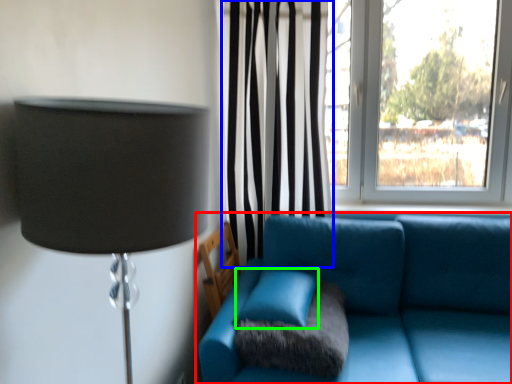
Question: Based on their relative distances, which object is farther from studio couch (highlighted by a red box)? Choose from curtain (highlighted by a blue box) and turquoise (highlighted by a green box).

Choices:
 (A) curtain
 (B) turquoise

Answer: (A)